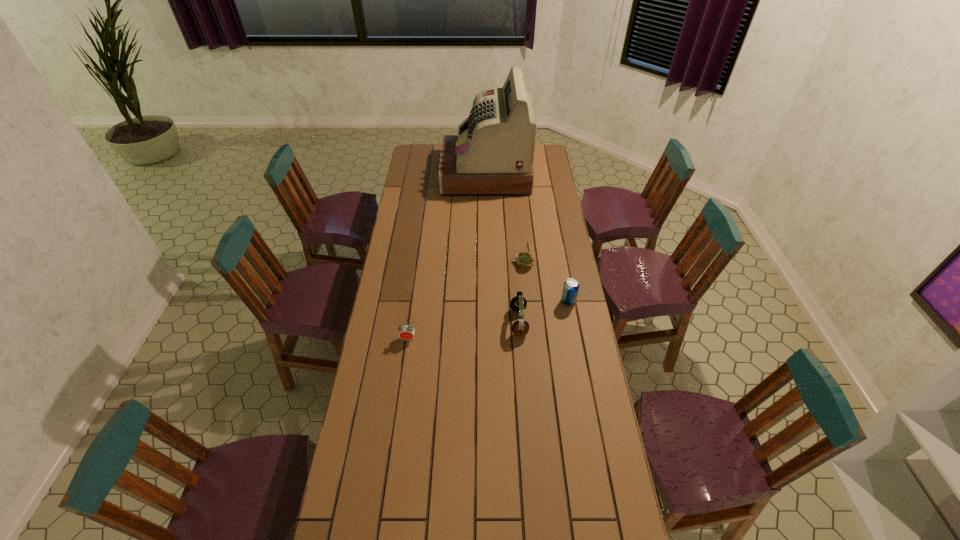
Find the location of a particular element. beer can that is at the right edge is located at coordinates (571, 287).

The width and height of the screenshot is (960, 540). I want to click on object that is at the far right corner, so click(x=492, y=155).

Locate an element on the screen. This screenshot has height=540, width=960. blank area at the left edge is located at coordinates (383, 410).

In the image, there is a desktop. Identify the location of vacant space at the right edge. The height and width of the screenshot is (540, 960). (579, 522).

The image size is (960, 540). Find the location of `vacant space at the far left corner of the desktop`. vacant space at the far left corner of the desktop is located at coordinates (423, 157).

This screenshot has width=960, height=540. I want to click on free location at the far right corner, so click(x=550, y=154).

This screenshot has height=540, width=960. What are the coordinates of `empty space that is in between the rightmost object and the compass` in the screenshot? It's located at (545, 282).

Identify the location of unoccupied area between the alarm clock and the rightmost object. Image resolution: width=960 pixels, height=540 pixels. (488, 320).

Locate an element on the screen. This screenshot has width=960, height=540. free spot between the tallest object and the headset is located at coordinates (502, 248).

In order to click on free point between the leftmost object and the headset in this screenshot , I will do `click(464, 330)`.